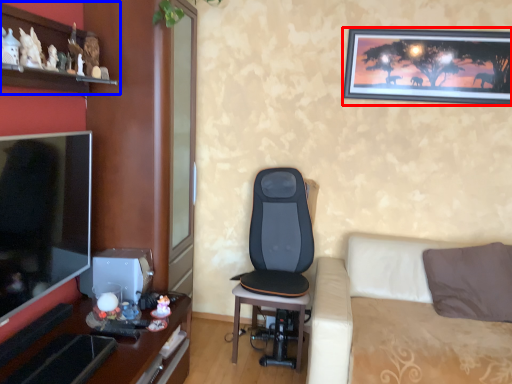
Question: Which object appears closest to the camera in this image, picture frame (highlighted by a red box) or shelf (highlighted by a blue box)?

Choices:
 (A) picture frame
 (B) shelf

Answer: (B)